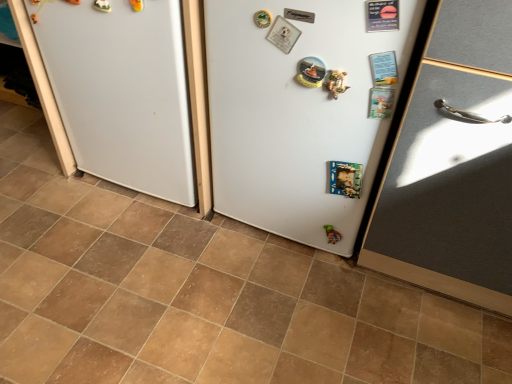
Question: Is brown tile at center wider or thinner than white matte refrigerator at center, acting as the 2th fridge starting from the left?

Choices:
 (A) wide
 (B) thin

Answer: (A)

Question: Is brown tile at center in front of or behind white matte refrigerator at center, the 1th fridge when ordered from right to left, in the image?

Choices:
 (A) behind
 (B) front

Answer: (B)

Question: Which object is the closest to the matte gray door at right?

Choices:
 (A) white matte refrigerator at center, which appears as the first fridge when viewed from the left
 (B) brown tile at center
 (C) green matte toy at lower center
 (D) white matte refrigerator at center, acting as the 2th fridge starting from the left

Answer: (D)

Question: Considering the real-world distances, which object is closest to the white matte refrigerator at center, the 1th fridge when ordered from right to left?

Choices:
 (A) white matte refrigerator at center, which appears as the first fridge when viewed from the left
 (B) green matte toy at lower center
 (C) matte gray door at right
 (D) brown tile at center

Answer: (C)